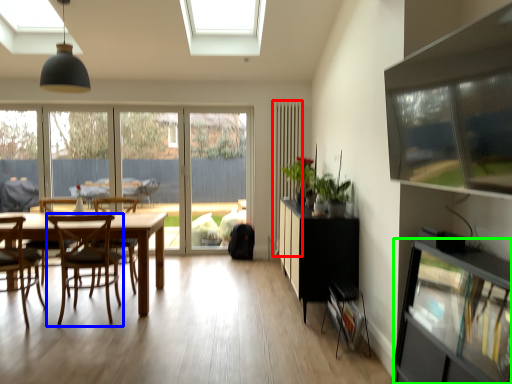
Question: Which object is the closest to the curtain (highlighted by a red box)? Choose among these: chair (highlighted by a blue box) or shelf (highlighted by a green box).

Choices:
 (A) chair
 (B) shelf

Answer: (A)